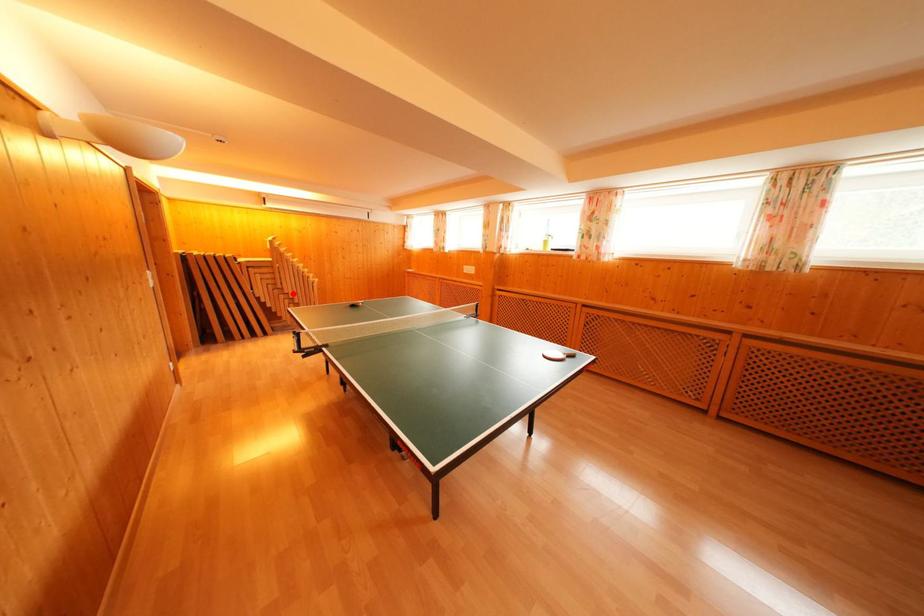
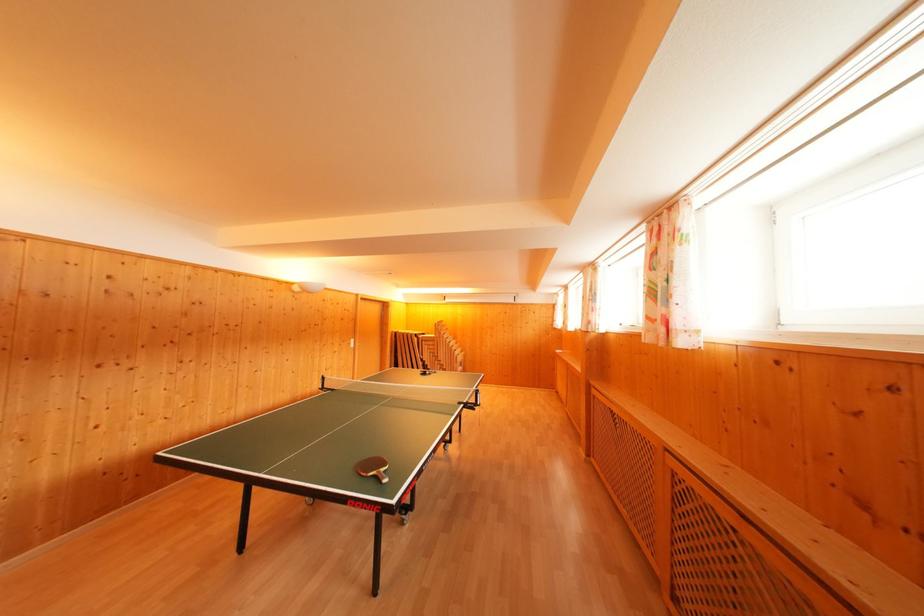
Question: A red point is marked in image1. In image2, is the corresponding 3D point closer to the camera or farther? Reply with the corresponding letter.

Choices:
 (A) The corresponding 3D point is closer.
 (B) The corresponding 3D point is farther.

Answer: (B)